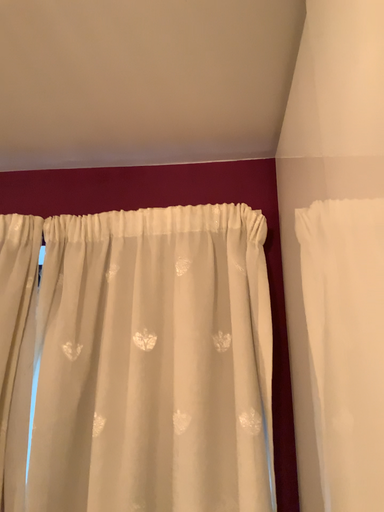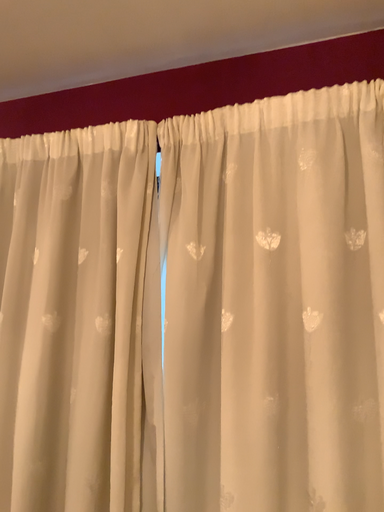
Question: Which way did the camera rotate in the video?

Choices:
 (A) rotated left
 (B) rotated right

Answer: (A)